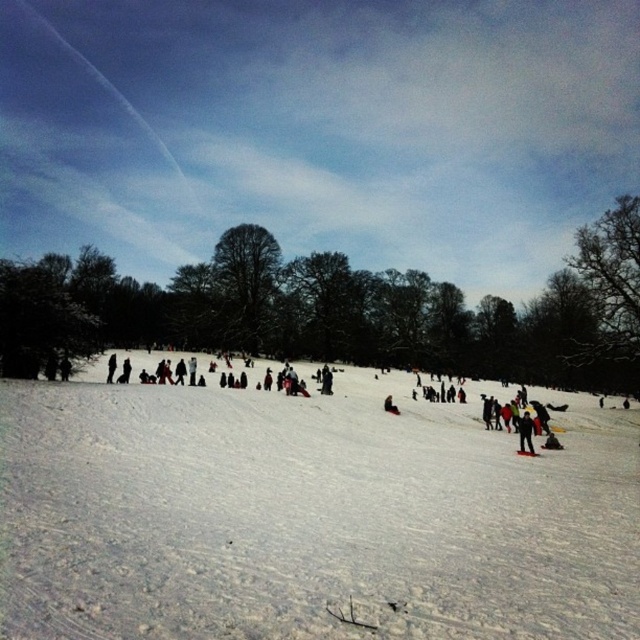
Which is more to the right, white snow at center or black matte jacket at lower right?

black matte jacket at lower right is more to the right.

Who is positioned more to the left, white snow at center or black matte jacket at lower right?

Positioned to the left is white snow at center.

Between point (520, 572) and point (518, 444), which one is positioned in front?

Point (520, 572) is more forward.

Locate an element on the screen. This screenshot has height=640, width=640. white snow at center is located at coordinates (301, 522).

Which is below, white snow at center or dark red fabric at center?

Positioned lower is white snow at center.

Is the position of white snow at center more distant than that of dark red fabric at center?

No, white snow at center is in front of dark red fabric at center.

The width and height of the screenshot is (640, 640). Identify the location of white snow at center. (301, 522).

Does black matte jacket at lower right have a greater height compared to white plastic ski at center?

Indeed, black matte jacket at lower right has a greater height compared to white plastic ski at center.

Which is above, black matte jacket at lower right or white plastic ski at center?

black matte jacket at lower right is higher up.

Is point (522, 419) positioned behind point (518, 454)?

That is True.

You are a GUI agent. You are given a task and a screenshot of the screen. Output one action in this format:
    pyautogui.click(x=<x>, y=<y>)
    Task: Click on the black matte jacket at lower right
    This screenshot has height=640, width=640.
    Given the screenshot: What is the action you would take?
    pyautogui.click(x=525, y=433)